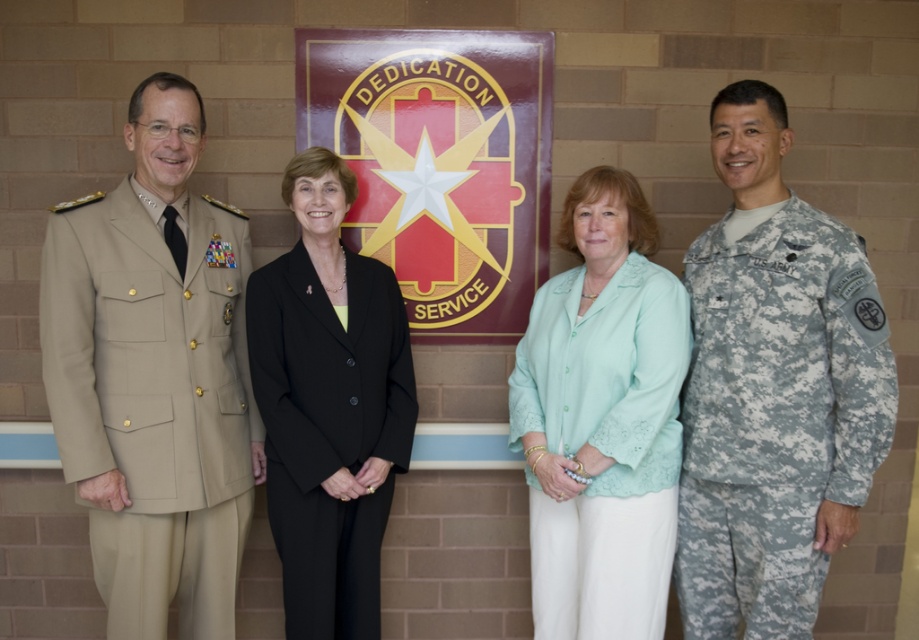
You are standing in front of the brick wall with the emblem. Where is the tan fabric uniform at left located in relation to the emblem?

The tan fabric uniform at left is positioned at point 0.625 along the horizontal axis and 0.169 along the vertical axis relative to the emblem.

You are standing in front of the brick wall with the emblem. You notice two points marked at coordinates point (101, 570) and point (739, 429). Which point is closer to you?

Point (739, 429) is closer to you because it is in front of point (101, 570).